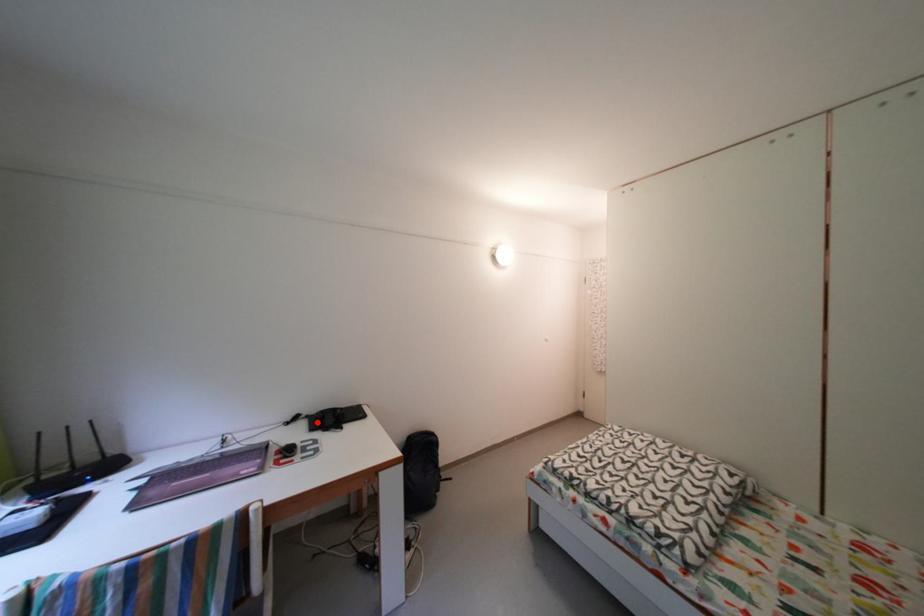
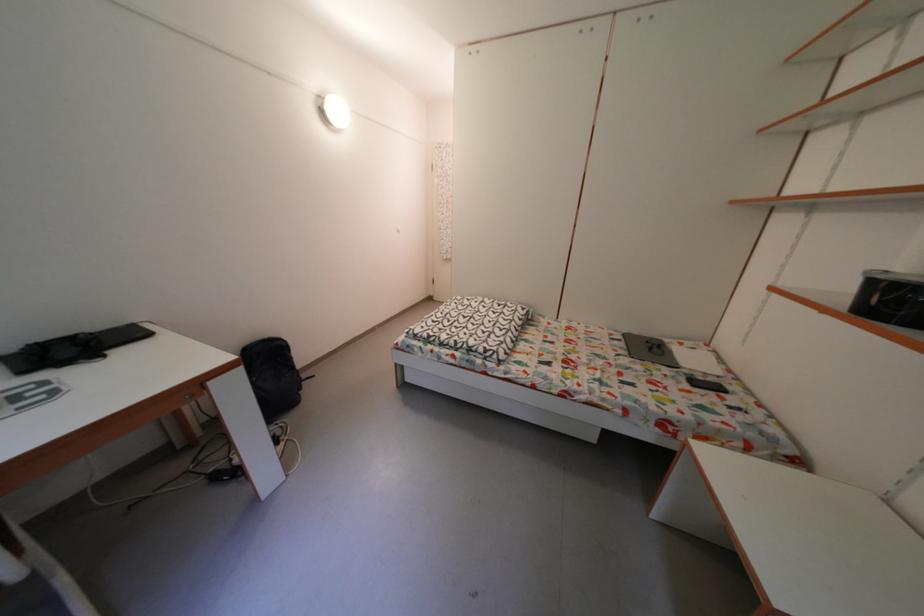
Question: I am providing you with two images of the same scene from different viewpoints. A red point is marked on the first image. At the location where the point appears in image 1, is it still visible in image 2?

Choices:
 (A) Yes
 (B) No

Answer: (A)